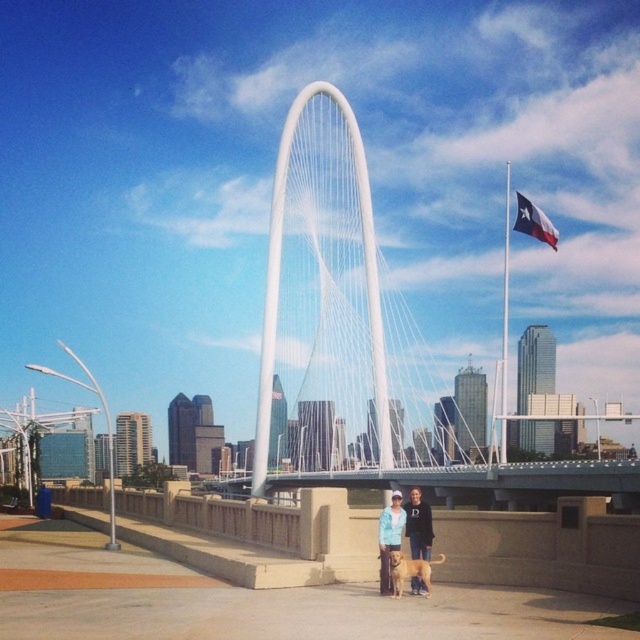
Question: Estimate the real-world distances between objects in this image. Which object is closer to the blue fabric flag at upper right?

Choices:
 (A) matte blue jacket at center
 (B) golden fur dog at center

Answer: (A)

Question: Which point appears closest to the camera in this image?

Choices:
 (A) (307, 477)
 (B) (531, 220)
 (C) (397, 506)
 (D) (404, 529)

Answer: (D)

Question: Can you confirm if golden fur dog at center is smaller than blue fabric flag at upper right?

Choices:
 (A) no
 (B) yes

Answer: (B)

Question: Can you confirm if white cable-stayed bridge at center is positioned below matte blue jacket at center?

Choices:
 (A) no
 (B) yes

Answer: (B)

Question: Is white cable-stayed bridge at center to the left of blue fabric flag at upper right from the viewer's perspective?

Choices:
 (A) no
 (B) yes

Answer: (B)

Question: Which is nearer to the blue fabric flag at upper right?

Choices:
 (A) matte blue jacket at center
 (B) white cable-stayed bridge at center
 (C) golden fur dog at center

Answer: (A)